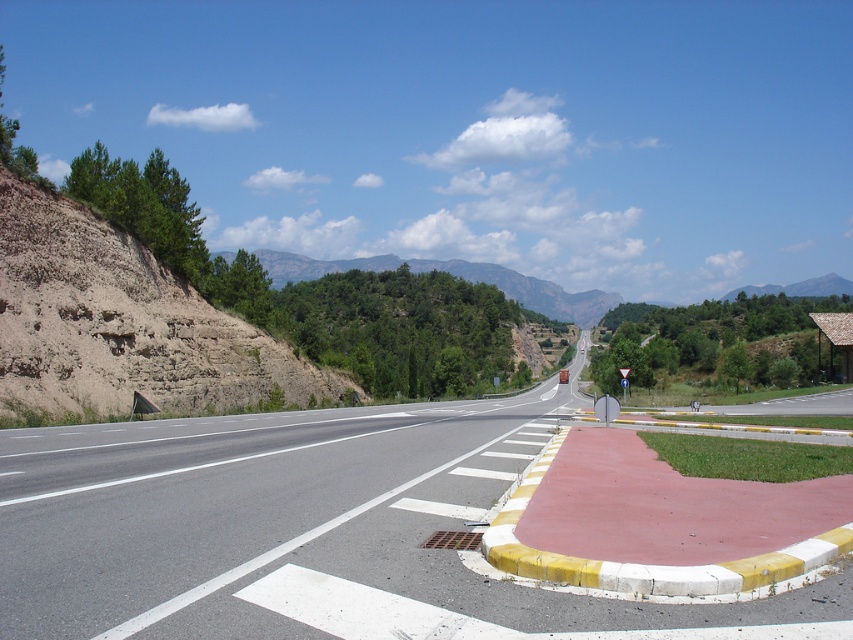
You are driving a truck that is 20 feet long. You need to park your truck between the asphalt road at center and the brown rocky cliff at left. Is there enough space for your truck to park there?

The asphalt road at center is 31.37 feet from the brown rocky cliff at left. Since your truck is 20 feet long, there is enough space to park between them as 31.37 feet is greater than 20 feet.

You are driving a delivery truck that is 2.5 meters wide. You need to navigate through the asphalt road at center. Considering the road is next to the brown rocky cliff at left, will your truck fit safely between the cliff and the opposite lane divider without encroaching into the oncoming traffic lane?

The asphalt road at center is positioned on the right side of brown rocky cliff at left. Since the truck is 2.5 meters wide and the road is divided into lanes, the truck should fit safely within its lane as long as it stays between the cliff and the lane divider. However, the driver must ensure there is sufficient space and avoid crossing into oncoming traffic.

You are a hiker planning to take a photo of the brown rocky cliff at left and the green forested mountain at upper center. Which object should you stand closer to in order to capture both in a single frame without zooming?

To capture both the brown rocky cliff at left and the green forested mountain at upper center in a single frame without zooming, you should stand closer to the brown rocky cliff at left since it is shorter than the green forested mountain at upper center. This allows the taller mountain to fit within the frame while still including the cliff.